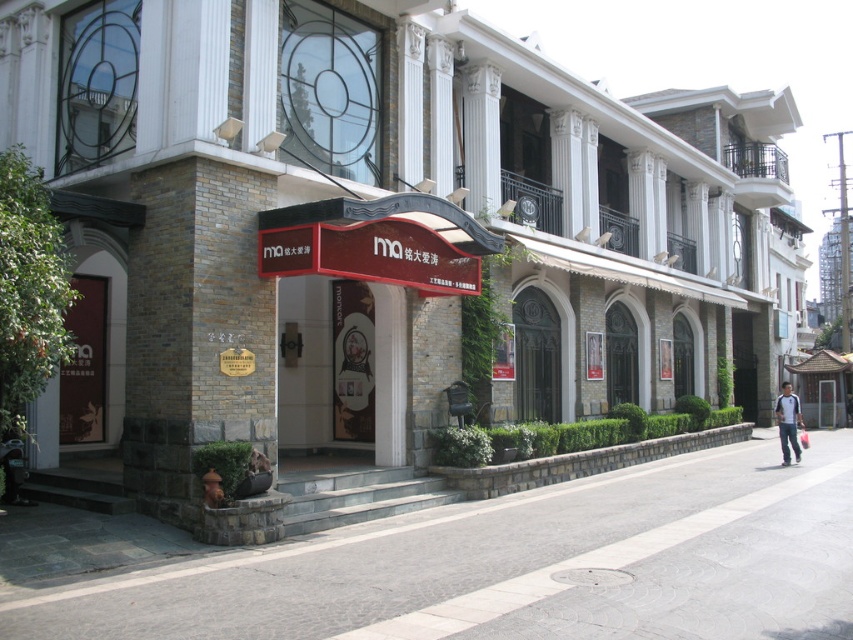
Question: Can you confirm if gray concrete pavement at lower center is positioned to the left of blue jeans at lower right?

Choices:
 (A) no
 (B) yes

Answer: (B)

Question: In this image, where is gray concrete pavement at lower center located relative to blue jeans at lower right?

Choices:
 (A) above
 (B) below

Answer: (B)

Question: Which object is farther from the camera taking this photo?

Choices:
 (A) gray concrete pavement at lower center
 (B) blue jeans at lower right

Answer: (B)

Question: Is the position of gray concrete pavement at lower center more distant than that of blue jeans at lower right?

Choices:
 (A) no
 (B) yes

Answer: (A)

Question: Among these points, which one is nearest to the camera?

Choices:
 (A) (62, 625)
 (B) (782, 433)

Answer: (A)